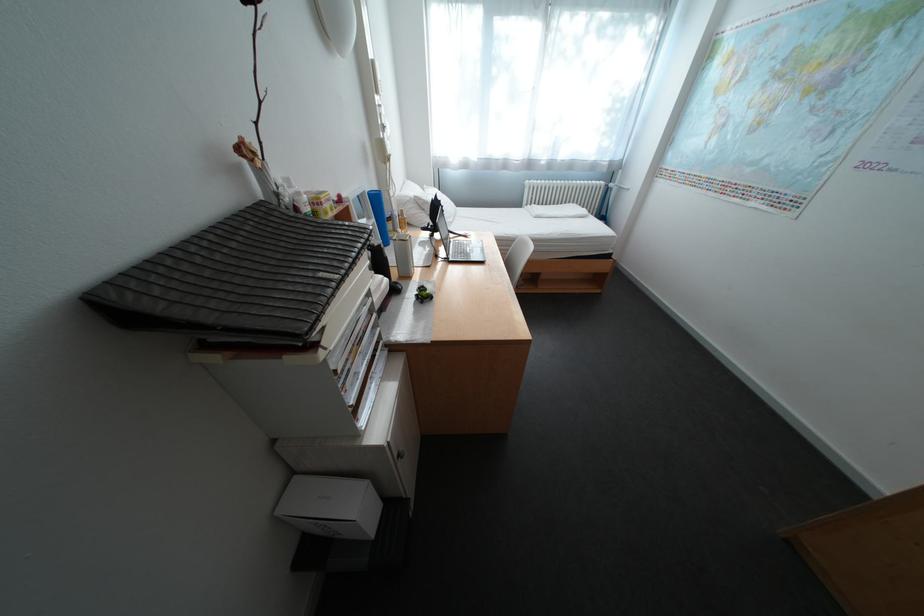
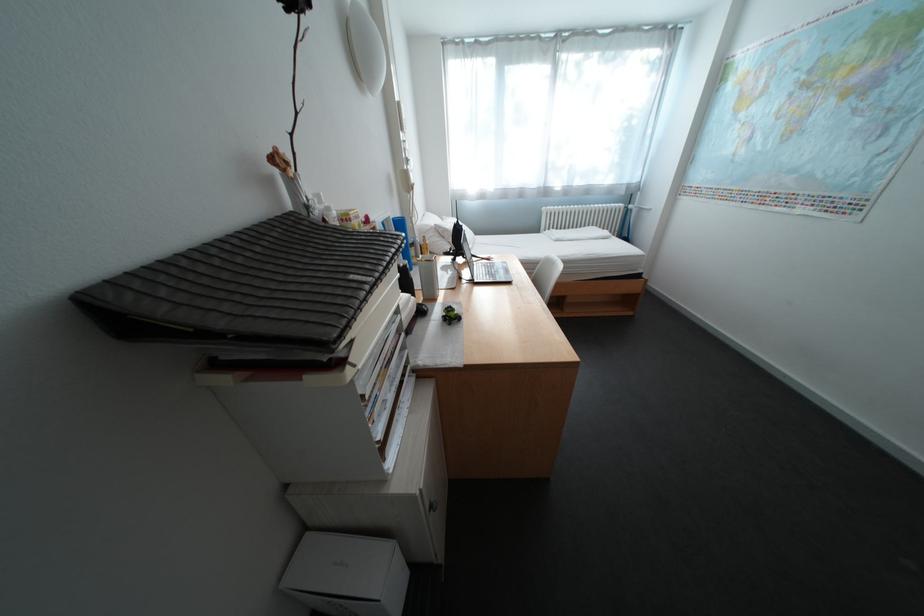
The images are taken continuously from a first-person perspective. In which direction are you moving?

The movement direction of the cameraman is left, forward.